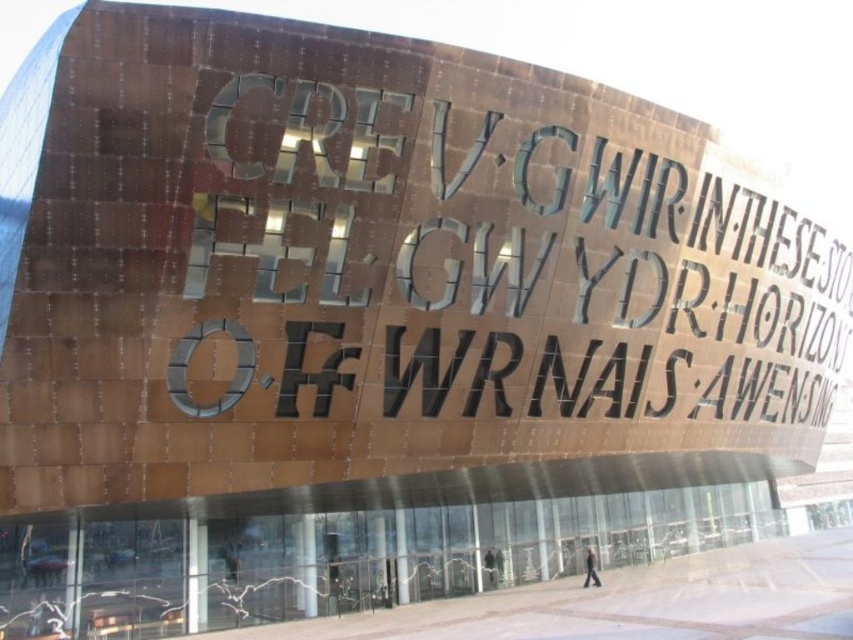
Question: Estimate the real-world distances between objects in this image. Which object is closer to the dark gray jacket at center?

Choices:
 (A) dark gray jacket at lower center
 (B) dark gray suit at center

Answer: (B)

Question: Where is dark gray jacket at lower center located in relation to dark gray suit at center in the image?

Choices:
 (A) left
 (B) right

Answer: (B)

Question: Which object is closer to the camera taking this photo?

Choices:
 (A) dark gray jacket at center
 (B) dark gray jacket at lower center
 (C) dark gray suit at center

Answer: (B)

Question: Considering the real-world distances, which object is closest to the dark gray jacket at center?

Choices:
 (A) dark gray suit at center
 (B) dark gray jacket at lower center

Answer: (A)

Question: Does dark gray jacket at center have a greater width compared to dark gray suit at center?

Choices:
 (A) no
 (B) yes

Answer: (B)

Question: Can you confirm if dark gray jacket at lower center is positioned to the right of dark gray jacket at center?

Choices:
 (A) yes
 (B) no

Answer: (A)